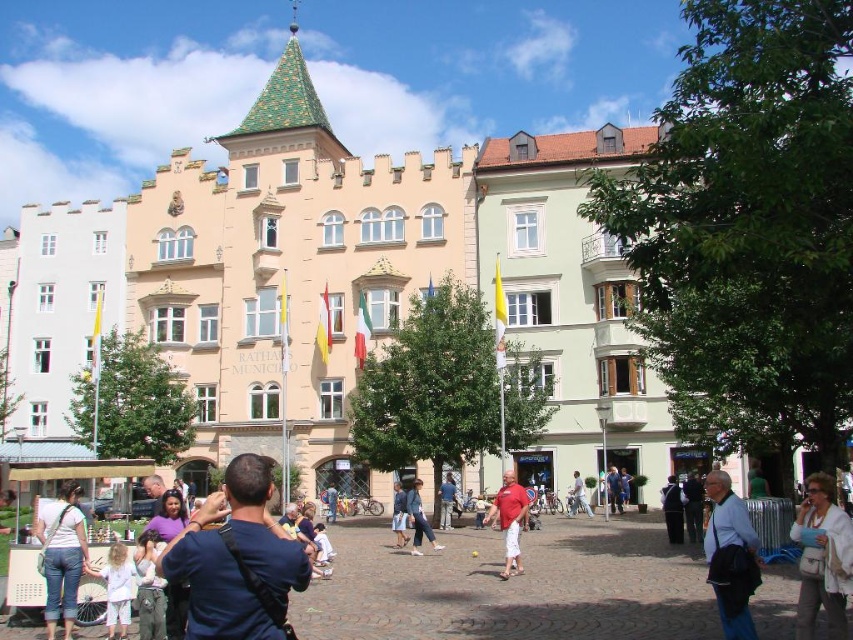
Question: Is denim shorts at lower left bigger than blue fabric shirt at lower right?

Choices:
 (A) yes
 (B) no

Answer: (B)

Question: Is dark blue shirt at center to the right of matte red shirt at center from the viewer's perspective?

Choices:
 (A) yes
 (B) no

Answer: (B)

Question: Can you confirm if white fabric purse at center is positioned above matte red shirt at center?

Choices:
 (A) yes
 (B) no

Answer: (A)

Question: Among these points, which one is farthest from the camera?

Choices:
 (A) (407, 502)
 (B) (732, 525)
 (C) (822, 604)

Answer: (A)

Question: Among these objects, which one is farthest from the camera?

Choices:
 (A) white fabric purse at center
 (B) matte red shirt at center

Answer: (B)

Question: Which point is closer to the camera?

Choices:
 (A) matte red shirt at center
 (B) dark blue shirt at center

Answer: (B)